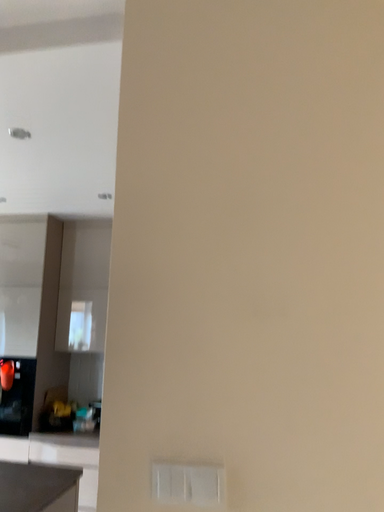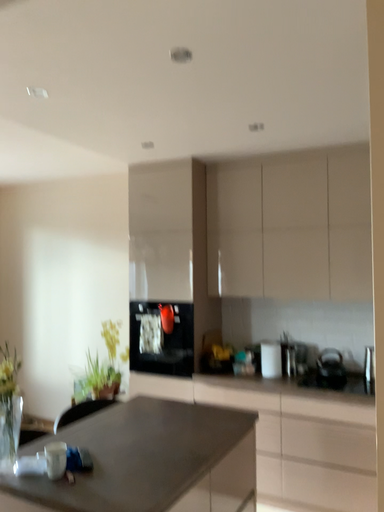
Question: Which way did the camera rotate in the video?

Choices:
 (A) rotated right
 (B) rotated left

Answer: (B)